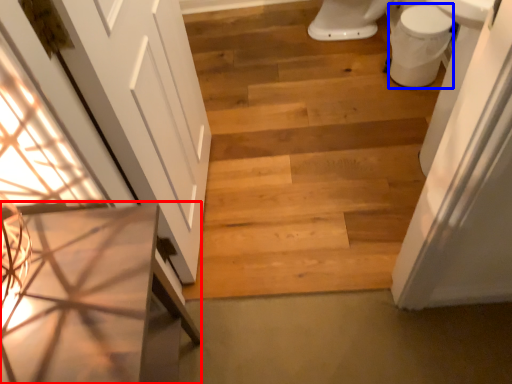
Question: Which object is further to the camera taking this photo, vanity (highlighted by a red box) or toilet bowl (highlighted by a blue box)?

Choices:
 (A) vanity
 (B) toilet bowl

Answer: (B)